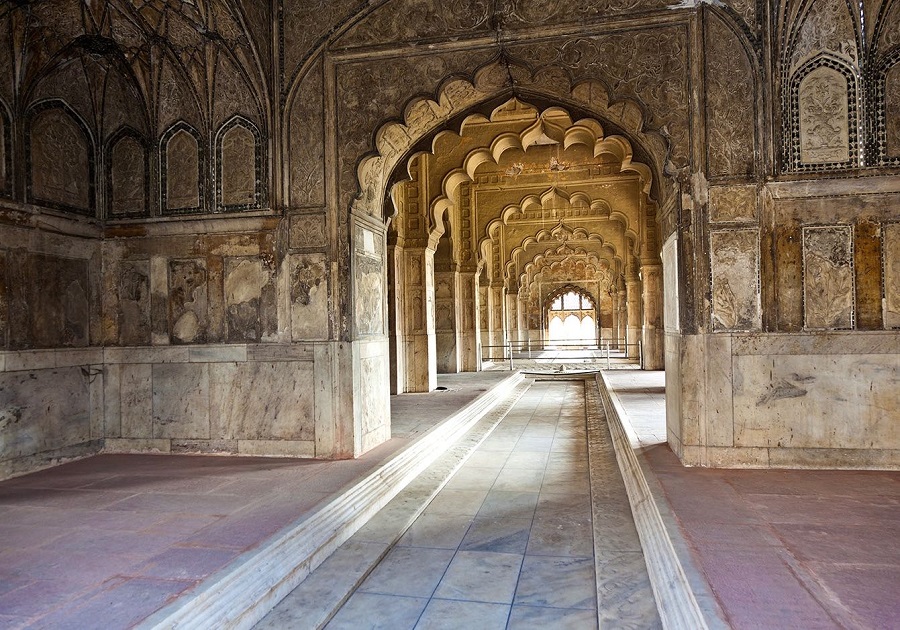
The width and height of the screenshot is (900, 630). What are the coordinates of `door` in the screenshot? It's located at (580, 324).